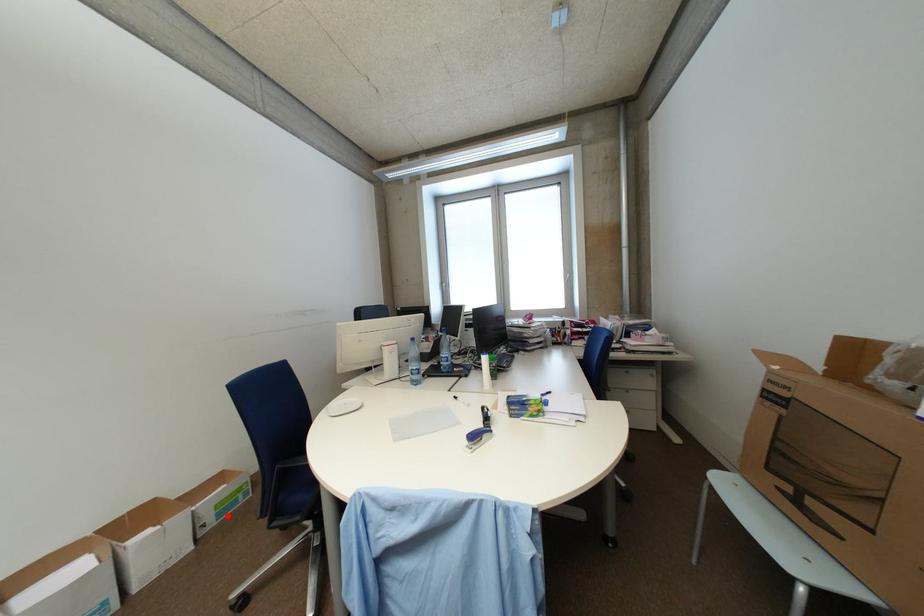
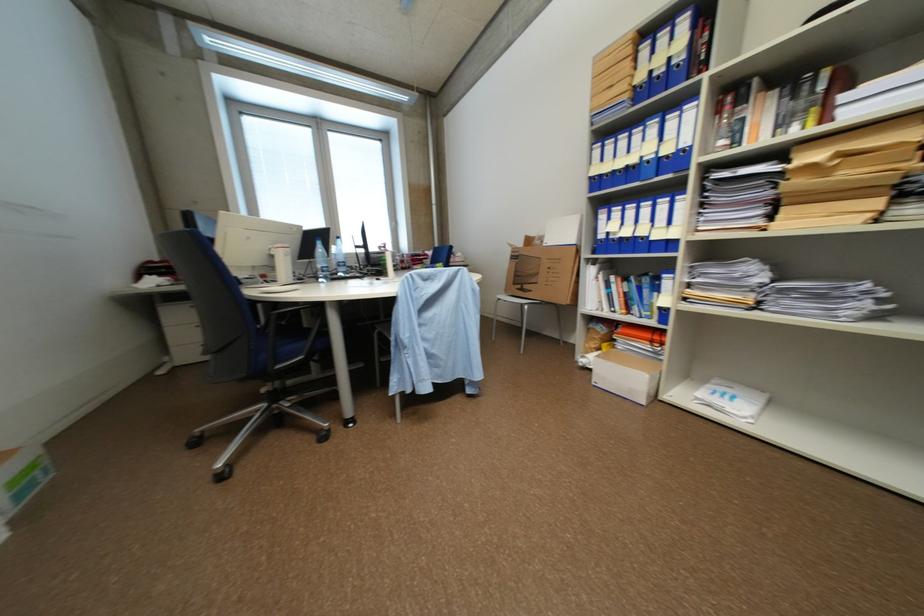
Find the pixel in the second image that matches the highlighted location in the first image.

(28, 496)